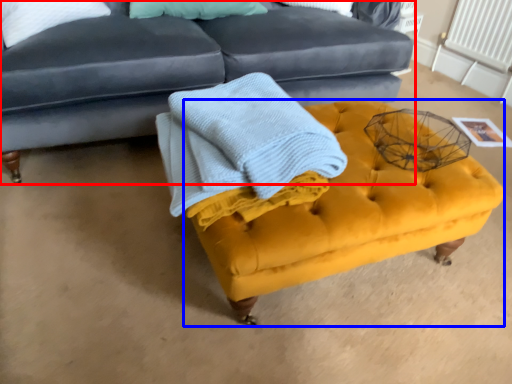
Question: Which of the following is the closest to the observer, studio couch (highlighted by a red box) or swivel chair (highlighted by a blue box)?

Choices:
 (A) studio couch
 (B) swivel chair

Answer: (B)